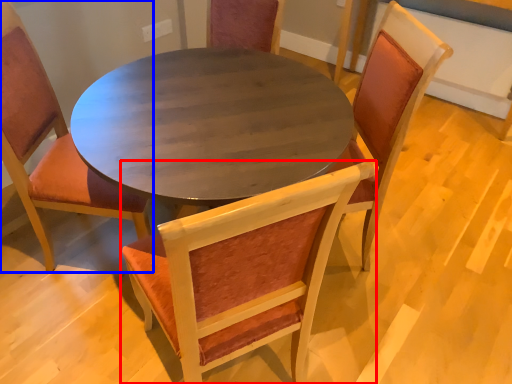
Question: Among these objects, which one is farthest to the camera, chair (highlighted by a red box) or chair (highlighted by a blue box)?

Choices:
 (A) chair
 (B) chair

Answer: (B)